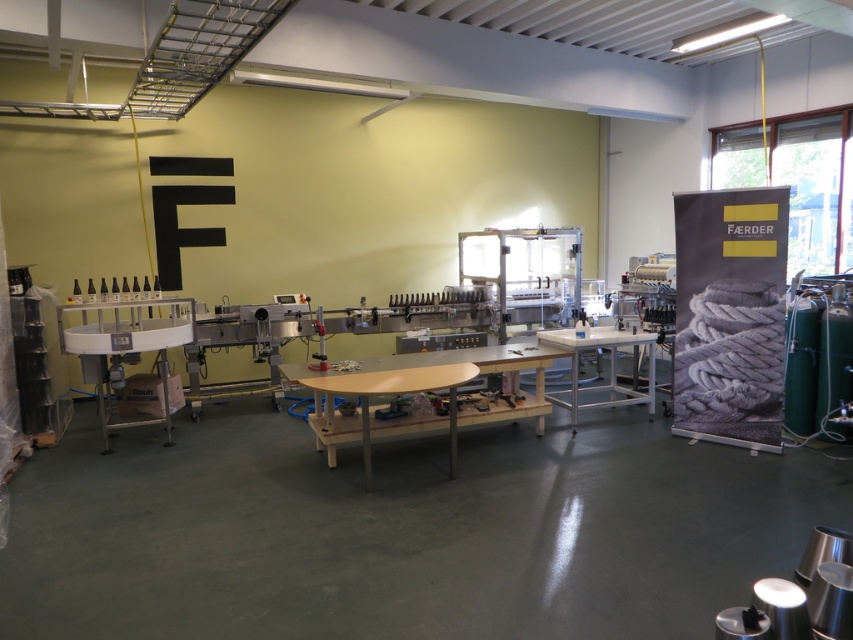
Question: Which of the following is the farthest from the observer?

Choices:
 (A) (509, 371)
 (B) (582, 390)
 (C) (103, 324)

Answer: (B)

Question: Where is light brown wooden table at center located in relation to metallic gray table at left in the image?

Choices:
 (A) below
 (B) above

Answer: (A)

Question: Which object appears farthest from the camera in this image?

Choices:
 (A) light brown wooden table at center
 (B) metallic gray table at left

Answer: (B)

Question: Is metallic gray table at left wider than metallic silver table at center?

Choices:
 (A) yes
 (B) no

Answer: (A)

Question: Which object is farther from the camera taking this photo?

Choices:
 (A) light brown wooden table at center
 (B) metallic silver table at center
 (C) metallic gray table at left

Answer: (B)

Question: Can you confirm if light brown wooden table at center is positioned above metallic silver table at center?

Choices:
 (A) no
 (B) yes

Answer: (A)